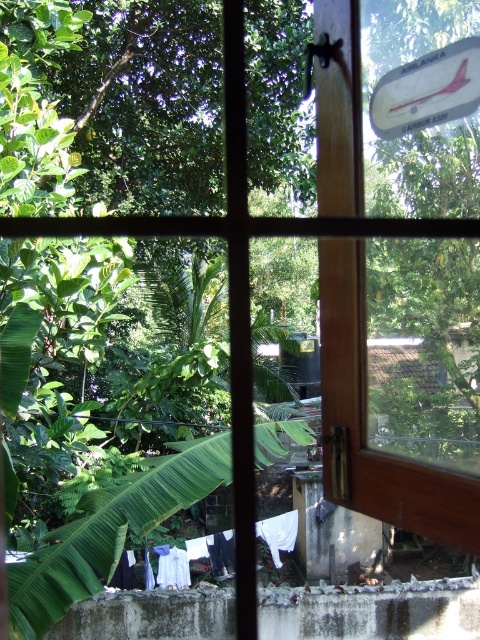
Question: In this image, where is metallic reflective airplane at upper right located relative to white fabric at lower center?

Choices:
 (A) right
 (B) left

Answer: (A)

Question: Which object appears closest to the camera in this image?

Choices:
 (A) metallic reflective airplane at upper right
 (B) white fabric at lower center

Answer: (A)

Question: Does metallic reflective airplane at upper right appear on the right side of white fabric at lower center?

Choices:
 (A) yes
 (B) no

Answer: (A)

Question: Does metallic reflective airplane at upper right have a smaller size compared to white fabric at lower center?

Choices:
 (A) yes
 (B) no

Answer: (A)